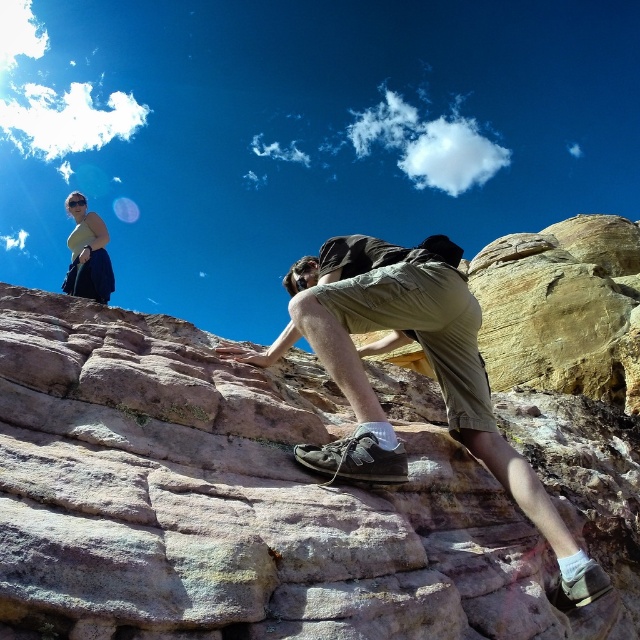
Who is lower down, matte khaki shorts at center or matte yellow top at upper left?

matte khaki shorts at center is lower down.

Is matte khaki shorts at center in front of matte yellow top at upper left?

Yes, matte khaki shorts at center is in front of matte yellow top at upper left.

You are a GUI agent. You are given a task and a screenshot of the screen. Output one action in this format:
    pyautogui.click(x=<x>, y=<y>)
    Task: Click on the matte khaki shorts at center
    The height and width of the screenshot is (640, 640).
    Given the screenshot: What is the action you would take?
    pyautogui.click(x=429, y=362)